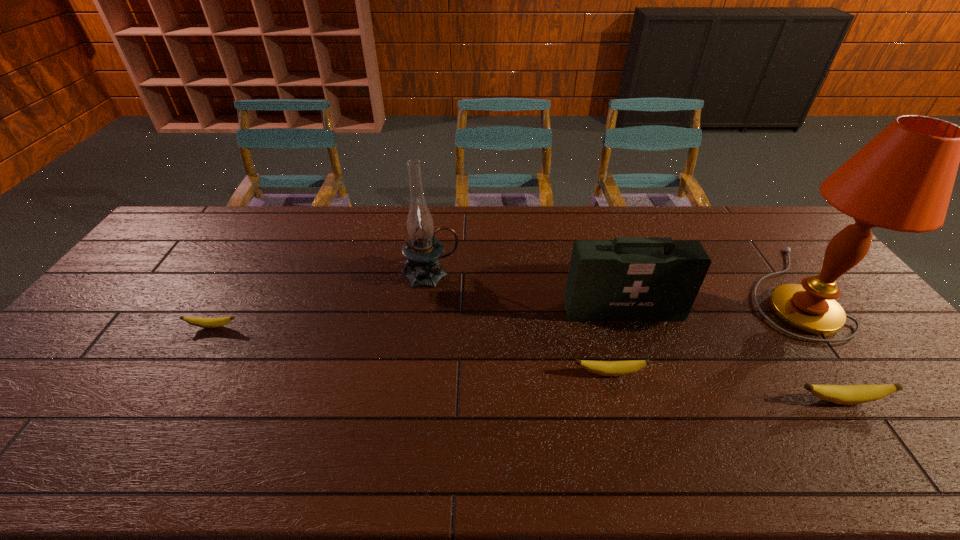
The height and width of the screenshot is (540, 960). Find the location of `free space at the far edge of the desktop`. free space at the far edge of the desktop is located at coordinates (510, 241).

In the image, there is a desktop. Where is `vacant space at the near edge`? vacant space at the near edge is located at coordinates (330, 402).

What are the coordinates of `free space at the right edge of the desktop` in the screenshot? It's located at (858, 305).

The height and width of the screenshot is (540, 960). Find the location of `free spot at the far left corner of the desktop`. free spot at the far left corner of the desktop is located at coordinates (198, 237).

Image resolution: width=960 pixels, height=540 pixels. In the image, there is a desktop. In order to click on blank space at the far right corner in this screenshot , I will do `click(745, 220)`.

The width and height of the screenshot is (960, 540). In order to click on free point between the fifth farthest object and the oil lamp in this screenshot , I will do `click(520, 324)`.

At what (x,y) coordinates should I click in order to perform the action: click on vacant space that's between the second banana from left to right and the tallest banana. Please return your answer as a coordinate pair (x, y). Looking at the image, I should click on (726, 387).

The image size is (960, 540). I want to click on unoccupied area between the lamp and the first-aid kit, so click(705, 301).

Where is `free space between the farthest banana and the second nearest banana`? The height and width of the screenshot is (540, 960). free space between the farthest banana and the second nearest banana is located at coordinates (411, 350).

Where is `free spot between the third tallest object and the tallest object`? The width and height of the screenshot is (960, 540). free spot between the third tallest object and the tallest object is located at coordinates (705, 301).